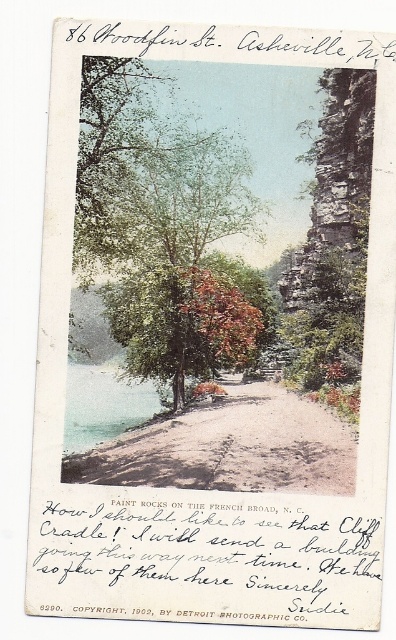
Can you confirm if green leafy tree at center is smaller than sandy dirt path at center?

No, green leafy tree at center is not smaller than sandy dirt path at center.

What do you see at coordinates (167, 246) in the screenshot?
I see `green leafy tree at center` at bounding box center [167, 246].

The image size is (396, 640). What do you see at coordinates (167, 246) in the screenshot?
I see `green leafy tree at center` at bounding box center [167, 246].

The image size is (396, 640). Find the location of `green leafy tree at center`. green leafy tree at center is located at coordinates (167, 246).